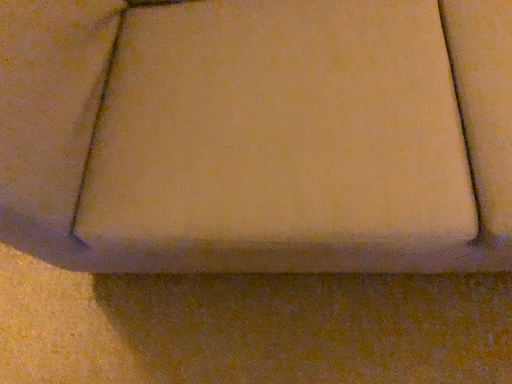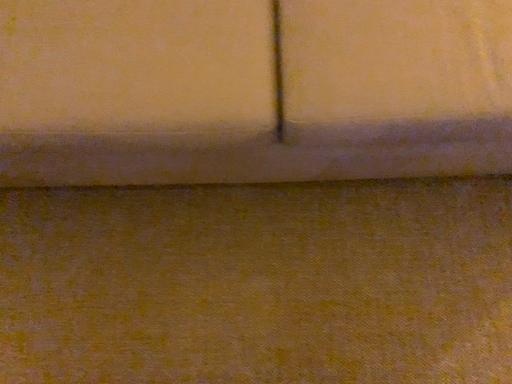
Question: Which way did the camera rotate in the video?

Choices:
 (A) rotated left
 (B) rotated right

Answer: (B)